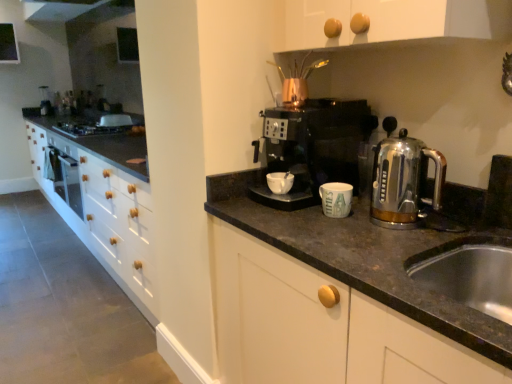
Question: From a real-world perspective, is white matte mug at center above or below satin chrome kettle at right?

Choices:
 (A) above
 (B) below

Answer: (B)

Question: Is white matte mug at center inside the boundaries of satin chrome kettle at right, or outside?

Choices:
 (A) outside
 (B) inside

Answer: (A)

Question: Considering the real-world distances, which object is farthest from the white glossy exhaust hood at upper center?

Choices:
 (A) matte ceramic mug at center
 (B) black glass gas stove at upper left
 (C) white matte mug at center
 (D) satin chrome kettle at right
 (E) brushed metal coffee machine at upper center

Answer: (A)

Question: Which object is positioned farthest from the matte ceramic mug at center?

Choices:
 (A) white matte mug at center
 (B) black glass gas stove at upper left
 (C) brushed metal coffee machine at upper center
 (D) black plastic coffee maker at center
 (E) satin chrome kettle at right

Answer: (C)